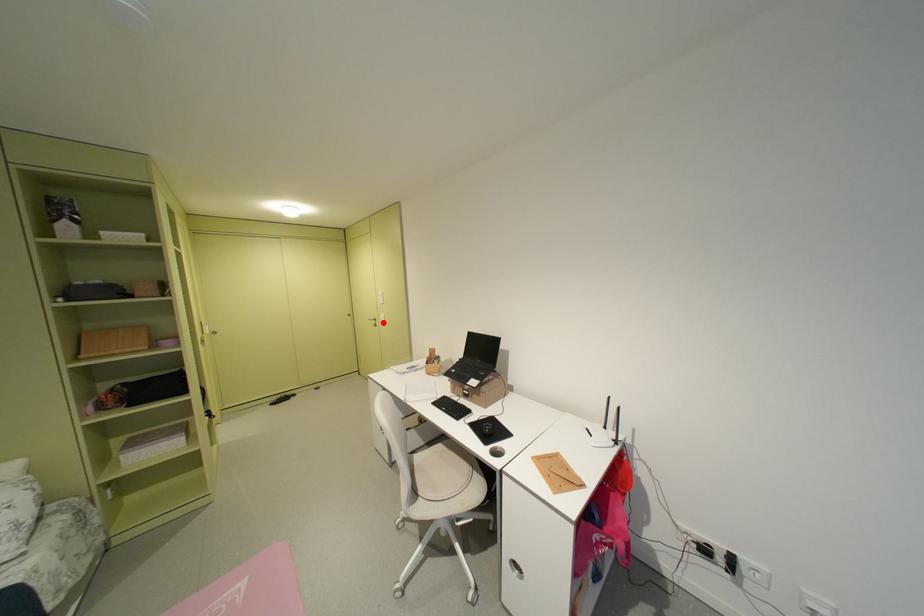
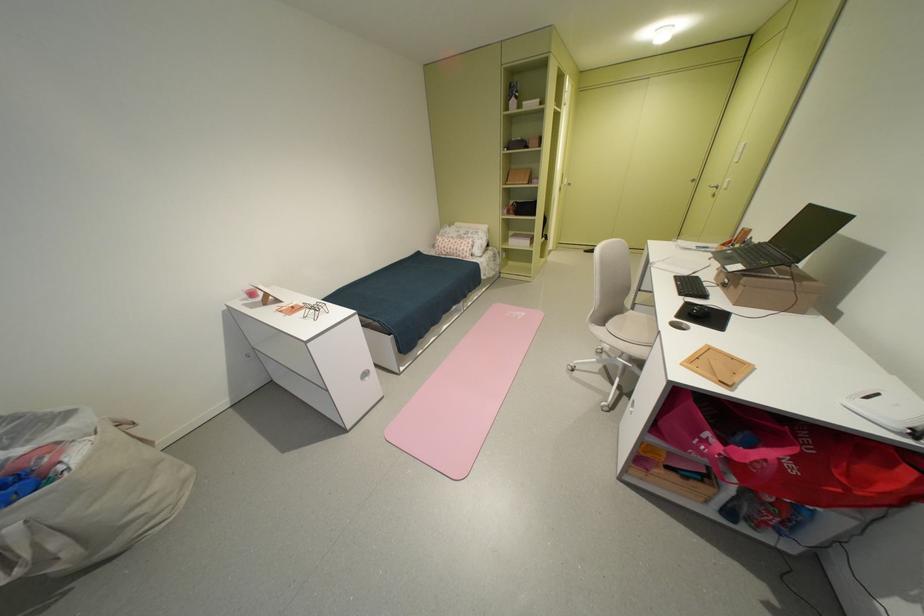
Question: I am providing you with two images of the same scene from different viewpoints. Image1 has a red point marked. In image2, the corresponding 3D location appears at what relative position? Reply with the corresponding letter.

Choices:
 (A) Closer
 (B) Farther

Answer: (A)